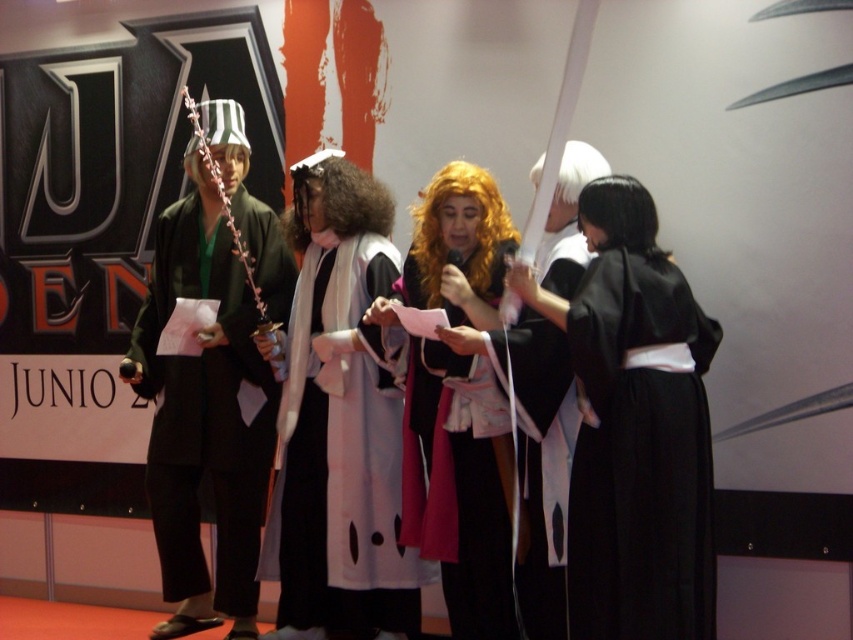
Looking at this image, is black silk kimono at right taller than black silky wig at right?

Indeed, black silk kimono at right has a greater height compared to black silky wig at right.

Looking at this image, does black silk kimono at right have a lesser width compared to black silky wig at right?

No.

Looking at this image, who is more distant from viewer, (694, 544) or (601, 186)?

The point (601, 186) is more distant.

In order to click on black silk kimono at right in this screenshot , I will do `click(637, 433)`.

Where is `shiny orange wig at center`? This screenshot has height=640, width=853. shiny orange wig at center is located at coordinates (439, 227).

From the picture: Who is positioned more to the left, shiny orange wig at center or curly brown wig at center?

curly brown wig at center

From the picture: Who is more forward, [479,172] or [349,161]?

Positioned in front is point [479,172].

Image resolution: width=853 pixels, height=640 pixels. I want to click on shiny orange wig at center, so click(439, 227).

Between point (444, 422) and point (346, 160), which one is positioned in front?

Point (444, 422) is more forward.

Which is above, matte black kimono at center or curly brown wig at center?

curly brown wig at center

Is point (495, 465) positioned behind point (291, 230)?

No.

What are the coordinates of `matte black kimono at center` in the screenshot? It's located at (457, 493).